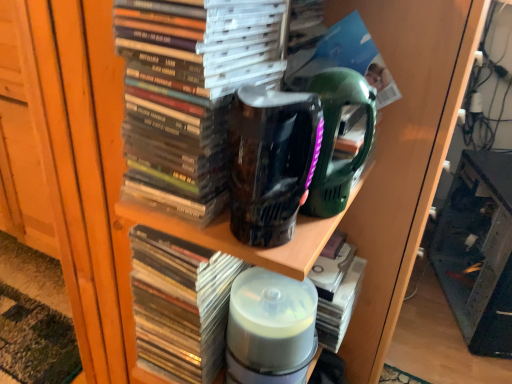
Question: From a real-world perspective, relative to transparent glass tank at lower right, is translucent plastic container at center vertically above or below?

Choices:
 (A) above
 (B) below

Answer: (A)

Question: Considering the positions of translucent plastic container at center and transparent glass tank at lower right in the image, is translucent plastic container at center wider or thinner than transparent glass tank at lower right?

Choices:
 (A) thin
 (B) wide

Answer: (A)

Question: Estimate the real-world distances between objects in this image. Which object is farther from the transparent plastic cd case at center, acting as the third book starting from the top?

Choices:
 (A) transparent glass tank at lower right
 (B) black glossy mug at center
 (C) matte black book at center, the first book from the top
 (D) translucent plastic container at center
 (E) translucent plastic books at center, which appears as the second book when ordered from the bottom

Answer: (A)

Question: Which is farther from the matte black book at center, the first book from the top?

Choices:
 (A) translucent plastic container at center
 (B) transparent plastic cd case at center, acting as the third book starting from the top
 (C) black glossy mug at center
 (D) translucent plastic books at center, which appears as the second book when ordered from the bottom
 (E) transparent glass tank at lower right

Answer: (E)